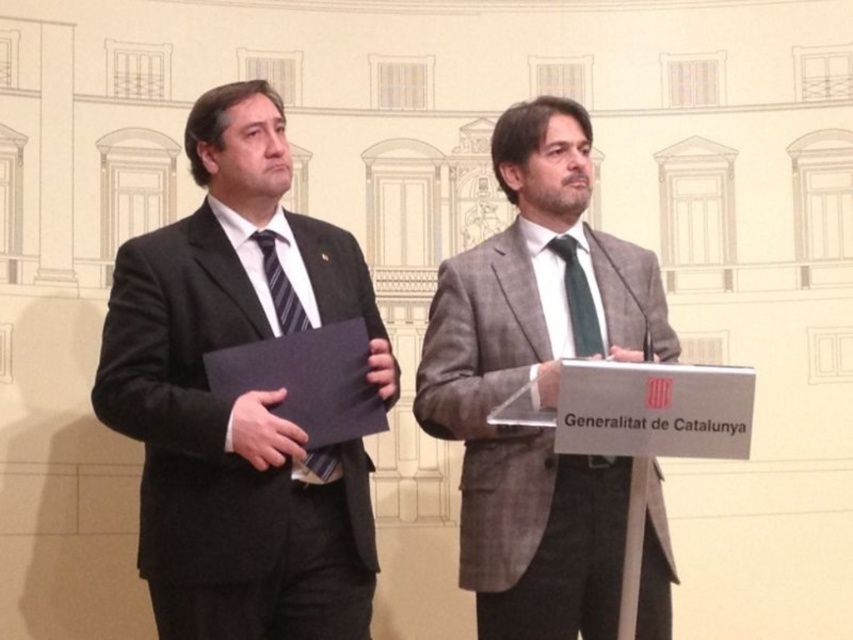
Does matte black suit at left have a greater height compared to green silk tie at center?

No, matte black suit at left is not taller than green silk tie at center.

How far apart are matte black suit at left and green silk tie at center?

A distance of 8.02 meters exists between matte black suit at left and green silk tie at center.

Which is behind, point (178, 260) or point (572, 246)?

The point (572, 246) is more distant.

The width and height of the screenshot is (853, 640). I want to click on matte black suit at left, so click(x=241, y=396).

Can you confirm if matte black suit at left is bigger than striped fabric tie at left?

No, matte black suit at left is not bigger than striped fabric tie at left.

Is matte black suit at left smaller than striped fabric tie at left?

Yes, matte black suit at left is smaller than striped fabric tie at left.

Identify the location of matte black suit at left. The height and width of the screenshot is (640, 853). (241, 396).

Does gray textured suit at center have a smaller size compared to green silk tie at center?

Yes, gray textured suit at center is smaller than green silk tie at center.

Locate an element on the screen. The height and width of the screenshot is (640, 853). gray textured suit at center is located at coordinates (538, 384).

This screenshot has width=853, height=640. I want to click on gray textured suit at center, so click(x=538, y=384).